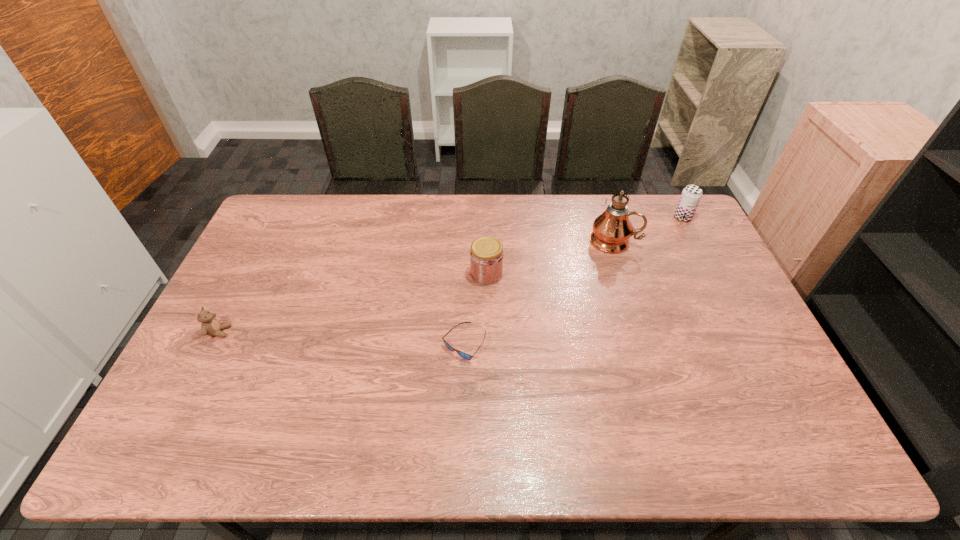
Identify the location of oil lamp. The image size is (960, 540). (612, 229).

Identify the location of the tallest object. The height and width of the screenshot is (540, 960). (612, 229).

The image size is (960, 540). I want to click on the rightmost object, so click(x=691, y=195).

I want to click on the farthest object, so click(x=691, y=195).

The image size is (960, 540). Identify the location of jam. (486, 257).

Identify the location of the fourth tallest object. The image size is (960, 540). (210, 326).

Locate an element on the screen. teddy bear is located at coordinates (210, 326).

Identify the location of sunglasses. The image size is (960, 540). (464, 355).

Locate an element on the screen. This screenshot has height=540, width=960. blank space located on the left of the tallest object is located at coordinates (516, 241).

Image resolution: width=960 pixels, height=540 pixels. I want to click on vacant region located on the back of the beer can, so click(x=671, y=194).